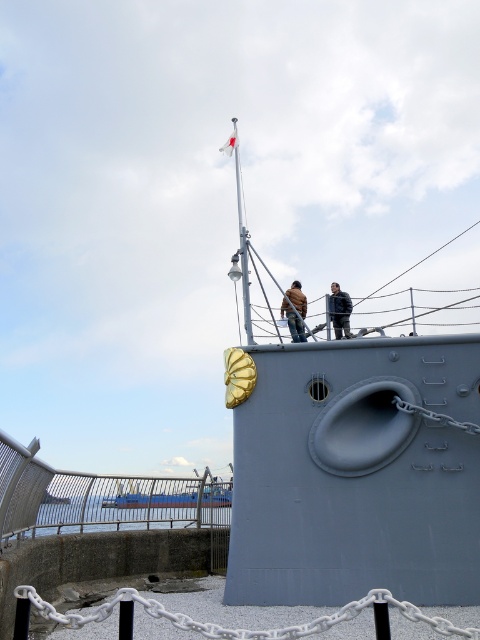
Between blue painted metal boat at lower center and brown leather jacket at upper center, which one is positioned higher?

brown leather jacket at upper center is higher up.

Can you confirm if blue painted metal boat at lower center is bigger than brown leather jacket at upper center?

Yes.

Measure the distance between point (x=132, y=502) and camera.

Point (x=132, y=502) is 11.56 meters from camera.

Identify the location of blue painted metal boat at lower center. (176, 497).

Consider the image. Can you confirm if brown leather jacket at upper center is shorter than dark blue leather jacket at upper center?

No, brown leather jacket at upper center is not shorter than dark blue leather jacket at upper center.

Is brown leather jacket at upper center to the right of dark blue leather jacket at upper center from the viewer's perspective?

In fact, brown leather jacket at upper center is to the left of dark blue leather jacket at upper center.

The width and height of the screenshot is (480, 640). Find the location of `brown leather jacket at upper center`. brown leather jacket at upper center is located at coordinates (295, 310).

Can you confirm if gray metallic boat at center is taller than brown leather jacket at upper center?

Indeed, gray metallic boat at center has a greater height compared to brown leather jacket at upper center.

Image resolution: width=480 pixels, height=640 pixels. I want to click on gray metallic boat at center, so click(x=352, y=465).

This screenshot has width=480, height=640. What are the coordinates of `gray metallic boat at center` in the screenshot? It's located at (352, 465).